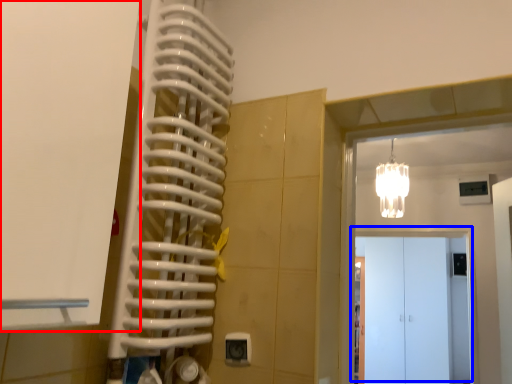
Question: Which object appears farthest to the camera in this image, door (highlighted by a red box) or door (highlighted by a blue box)?

Choices:
 (A) door
 (B) door

Answer: (B)